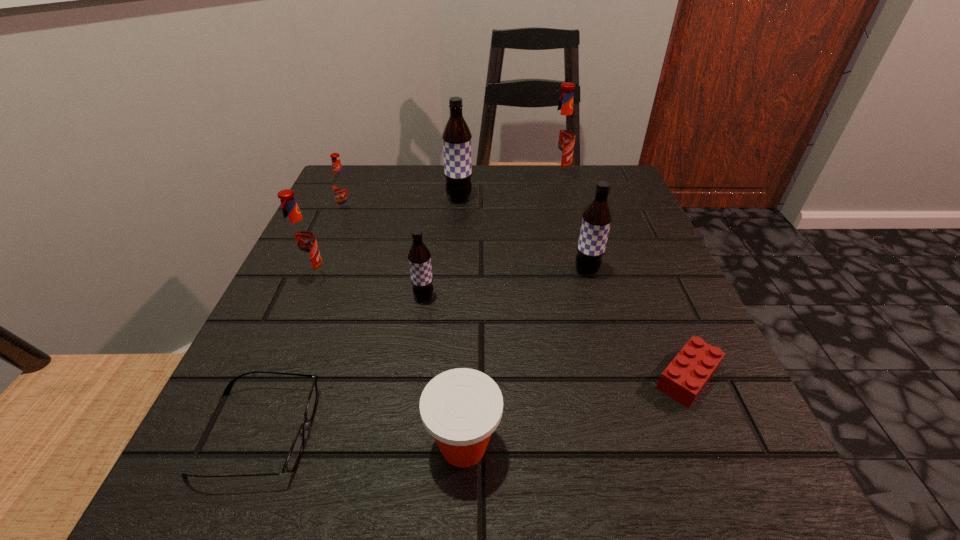
You are a GUI agent. You are given a task and a screenshot of the screen. Output one action in this format:
    pyautogui.click(x=<x>, y=<y>)
    Task: Click on the nearest brown root beer
    This screenshot has height=540, width=960.
    Given the screenshot: What is the action you would take?
    pyautogui.click(x=419, y=256)

Find the location of a particular element. red-orange Dixie cup is located at coordinates (461, 408).

This screenshot has height=540, width=960. What are the coordinates of `the seventh tallest object` in the screenshot? It's located at (461, 408).

The width and height of the screenshot is (960, 540). What are the coordinates of `red Lego` in the screenshot? It's located at 685,377.

Where is `the rightmost object`? the rightmost object is located at coordinates (685, 377).

Locate an element on the screen. The image size is (960, 540). spectacles is located at coordinates (295, 451).

In order to click on vacant region located on the front of the farthest root beer in this screenshot , I will do `click(564, 205)`.

Identify the location of free space located 0.130m on the left of the biggest brown root beer. click(x=389, y=198).

Identify the location of vacant space located on the back of the second biggest red root beer. (350, 191).

Identify the location of vacant space located on the back of the second nearest brown root beer. This screenshot has width=960, height=540. (571, 215).